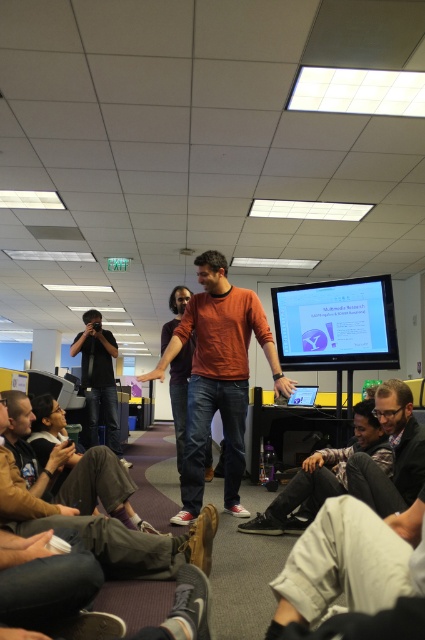
Question: Which object is farther from the camera taking this photo?

Choices:
 (A) jeans at center
 (B) matte orange shirt at center
 (C) dark gray jeans at lower center
 (D) black matte camera at left

Answer: (D)

Question: Does matte orange shirt at center have a larger size compared to matte white projector screen at upper right?

Choices:
 (A) no
 (B) yes

Answer: (B)

Question: Which of the following is the farthest from the observer?

Choices:
 (A) matte orange shirt at center
 (B) brown suede shoes at lower center
 (C) dark gray jeans at lower center
 (D) matte white projector screen at upper right

Answer: (D)

Question: Considering the relative positions of matte orange shirt at center and jeans at center in the image provided, where is matte orange shirt at center located with respect to jeans at center?

Choices:
 (A) above
 (B) below

Answer: (A)

Question: Which point is farther to the camera?

Choices:
 (A) (181, 394)
 (B) (345, 316)
 (C) (93, 396)

Answer: (C)

Question: Observing the image, what is the correct spatial positioning of matte orange shirt at center in reference to dark gray jeans at lower center?

Choices:
 (A) left
 (B) right

Answer: (A)